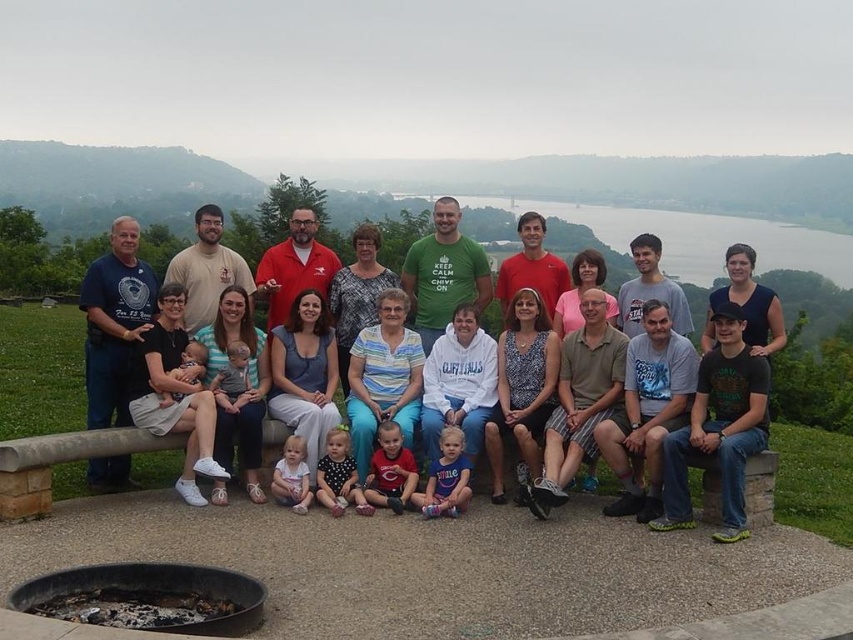
Does charred metal fire pit at lower left come in front of soft beige fabric baby at center?

Yes.

Between point (73, 600) and point (189, 376), which one is positioned in front?

Point (73, 600)

Is point (67, 580) more distant than point (178, 369)?

No.

Find the location of a particular element. The width and height of the screenshot is (853, 640). charred metal fire pit at lower left is located at coordinates (148, 596).

Does matte blue jeans at center come behind polka dot dress at center?

No, matte blue jeans at center is in front of polka dot dress at center.

Does matte blue jeans at center appear on the right side of polka dot dress at center?

Correct, you'll find matte blue jeans at center to the right of polka dot dress at center.

Between point (277, 353) and point (352, 465), which one is positioned behind?

Positioned behind is point (277, 353).

Find the location of a particular element. Image resolution: width=853 pixels, height=640 pixels. matte blue jeans at center is located at coordinates (x=689, y=433).

Can you confirm if charred metal fire pit at lower left is bigger than light pink fabric baby at center?

Yes, charred metal fire pit at lower left is bigger than light pink fabric baby at center.

What do you see at coordinates (148, 596) in the screenshot?
I see `charred metal fire pit at lower left` at bounding box center [148, 596].

Where is `charred metal fire pit at lower left`? charred metal fire pit at lower left is located at coordinates (148, 596).